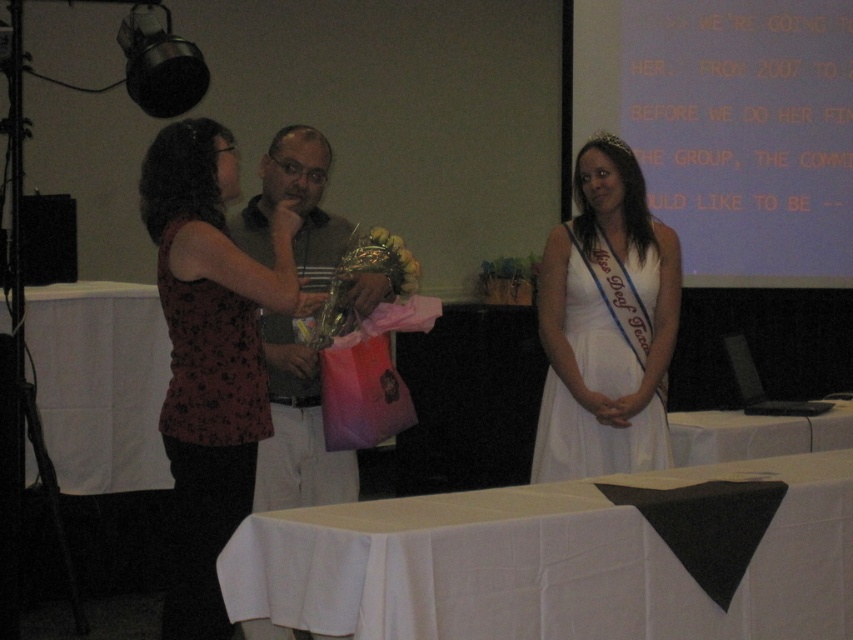
Does white cloth at lower center have a lesser height compared to white satin dress at center?

Indeed, white cloth at lower center has a lesser height compared to white satin dress at center.

Does white cloth at lower center appear under white satin dress at center?

Correct, white cloth at lower center is located below white satin dress at center.

At what (x,y) coordinates should I click in order to perform the action: click on white cloth at lower center. Please return your answer as a coordinate pair (x, y). Looking at the image, I should click on point(566,557).

Image resolution: width=853 pixels, height=640 pixels. I want to click on white cloth at lower center, so click(566, 557).

Does white cloth at lower center appear on the right side of white matte projection screen at upper center?

Incorrect, white cloth at lower center is not on the right side of white matte projection screen at upper center.

Who is more forward, (224, 580) or (666, 195)?

Positioned in front is point (224, 580).

Find the location of a particular element. The image size is (853, 640). white cloth at lower center is located at coordinates [566, 557].

Who is positioned more to the right, floral print blouse at left or white satin dress at center?

From the viewer's perspective, white satin dress at center appears more on the right side.

Is floral print blouse at left shorter than white satin dress at center?

No, floral print blouse at left is not shorter than white satin dress at center.

Is point (233, 518) more distant than point (621, 154)?

No, it is in front of (621, 154).

The height and width of the screenshot is (640, 853). Identify the location of floral print blouse at left. (209, 355).